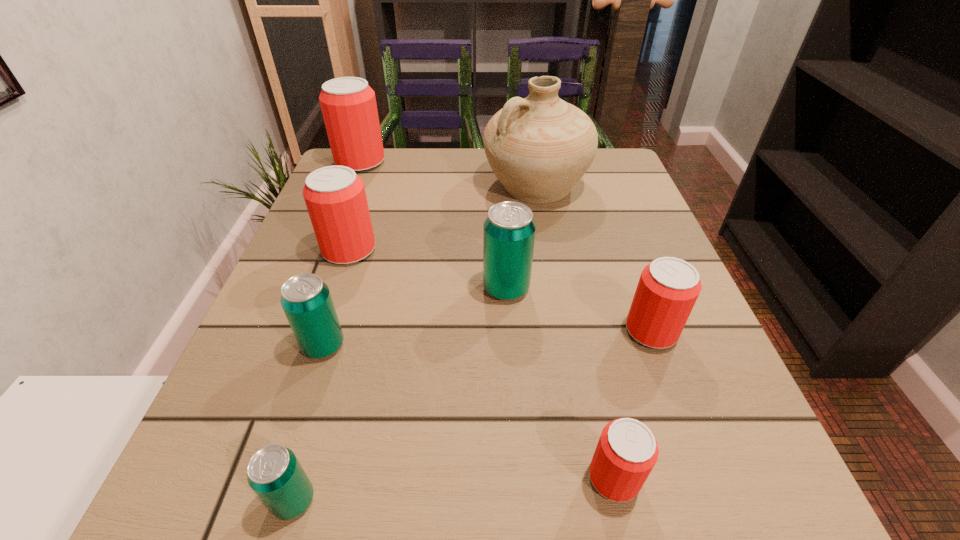
The image size is (960, 540). Find the location of `the smallest red beer can`. the smallest red beer can is located at coordinates (627, 451).

The width and height of the screenshot is (960, 540). In order to click on the third red beer can from left to right in this screenshot , I will do `click(627, 451)`.

I want to click on the smallest teal beer can, so click(274, 473).

This screenshot has width=960, height=540. In order to click on blank area located 0.060m on the right of the tallest object in this screenshot , I will do `click(612, 186)`.

Where is `free point located 0.160m on the front of the farthest beer can`? free point located 0.160m on the front of the farthest beer can is located at coordinates (341, 211).

Image resolution: width=960 pixels, height=540 pixels. Find the location of `vacant area situated on the front of the second farthest beer can`. vacant area situated on the front of the second farthest beer can is located at coordinates (289, 427).

Where is `vacant space located on the front of the fifth nearest beer can`? This screenshot has height=540, width=960. vacant space located on the front of the fifth nearest beer can is located at coordinates (519, 494).

What are the coordinates of `free space located on the front of the rightmost beer can` in the screenshot? It's located at (718, 513).

This screenshot has width=960, height=540. In order to click on free region located 0.240m on the right of the second farthest teal beer can in this screenshot , I will do `click(493, 346)`.

At what (x,y) coordinates should I click in order to perform the action: click on free space located on the right of the nearest red beer can. Please return your answer as a coordinate pair (x, y). Image resolution: width=960 pixels, height=540 pixels. Looking at the image, I should click on (687, 477).